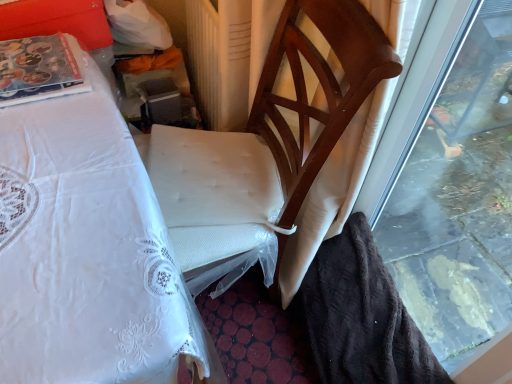
Question: Is transparent glass window at right in contact with wooden chair at center?

Choices:
 (A) no
 (B) yes

Answer: (A)

Question: From the image's perspective, is transparent glass window at right above wooden chair at center?

Choices:
 (A) yes
 (B) no

Answer: (B)

Question: From the image's perspective, does transparent glass window at right appear lower than wooden chair at center?

Choices:
 (A) no
 (B) yes

Answer: (B)

Question: Is transparent glass window at right outside of wooden chair at center?

Choices:
 (A) no
 (B) yes

Answer: (B)

Question: Considering the relative sizes of transparent glass window at right and wooden chair at center in the image provided, is transparent glass window at right bigger than wooden chair at center?

Choices:
 (A) no
 (B) yes

Answer: (A)

Question: Does point (243, 160) appear closer or farther from the camera than point (194, 59)?

Choices:
 (A) farther
 (B) closer

Answer: (B)

Question: Considering the positions of wooden chair at center and beige textured radiator at center in the image, is wooden chair at center bigger or smaller than beige textured radiator at center?

Choices:
 (A) small
 (B) big

Answer: (B)

Question: In terms of width, does wooden chair at center look wider or thinner when compared to beige textured radiator at center?

Choices:
 (A) wide
 (B) thin

Answer: (B)

Question: From the image's perspective, relative to beige textured radiator at center, is wooden chair at center above or below?

Choices:
 (A) above
 (B) below

Answer: (B)

Question: Is wooden chair at center bigger or smaller than transparent glass window at right?

Choices:
 (A) small
 (B) big

Answer: (B)

Question: In the image, is wooden chair at center positioned in front of or behind transparent glass window at right?

Choices:
 (A) behind
 (B) front

Answer: (A)

Question: Is wooden chair at center situated inside transparent glass window at right or outside?

Choices:
 (A) outside
 (B) inside

Answer: (A)

Question: From the image's perspective, is wooden chair at center positioned above or below transparent glass window at right?

Choices:
 (A) above
 (B) below

Answer: (A)

Question: Does point (230, 56) appear closer or farther from the camera than point (302, 140)?

Choices:
 (A) farther
 (B) closer

Answer: (A)

Question: Is beige textured radiator at center wider or thinner than wooden chair at center?

Choices:
 (A) wide
 (B) thin

Answer: (A)